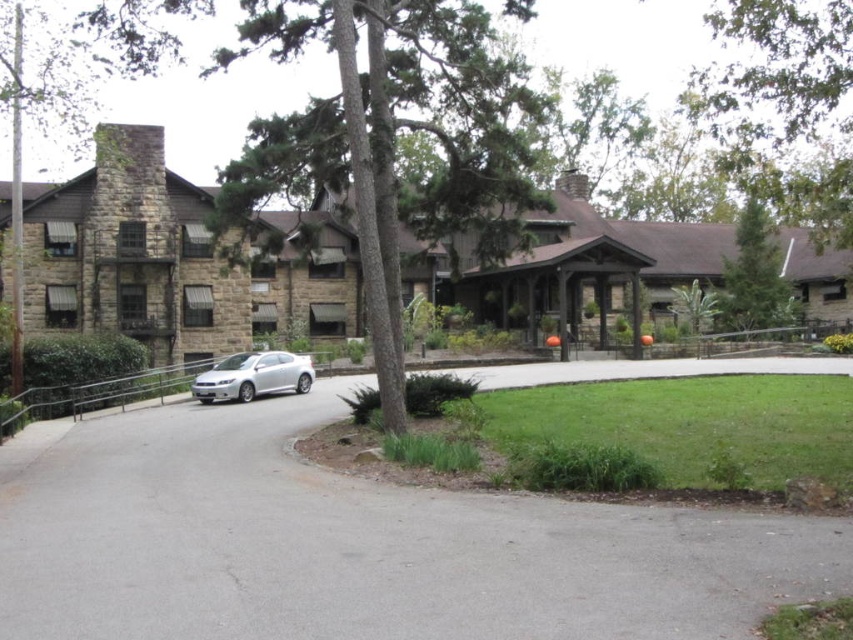
You are driving a satin silver car at center and want to park it on the gray asphalt driveway at center. Based on the scene description, can you park the car directly on the driveway without crossing any obstacles?

The gray asphalt driveway at center is positioned on the right side of the satin silver car at center, so the car is already aligned with the driveway and can be parked there without crossing any obstacles.

You are driving a delivery van that is 2 meters wide. You need to park on the gray asphalt driveway at center. Can you park your van there if the driveway is narrower than the green textured tree at center?

The gray asphalt driveway at center is narrower than the green textured tree at center, so the driveway is not wide enough to accommodate a delivery van that is 2 meters wide. You should look for a wider parking area.

You are a gardener planning to plant a new tree in the suburban scene. The gray asphalt driveway at center and the green textured tree at center are both in your view. Which object is shorter?

The gray asphalt driveway at center is shorter than the green textured tree at center.